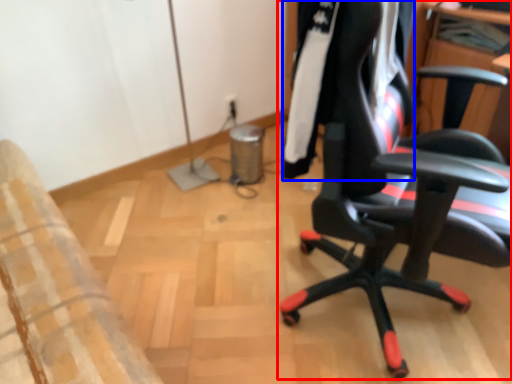
Question: Which of the following is the farthest to the observer, chair (highlighted by a red box) or clothing (highlighted by a blue box)?

Choices:
 (A) chair
 (B) clothing

Answer: (B)